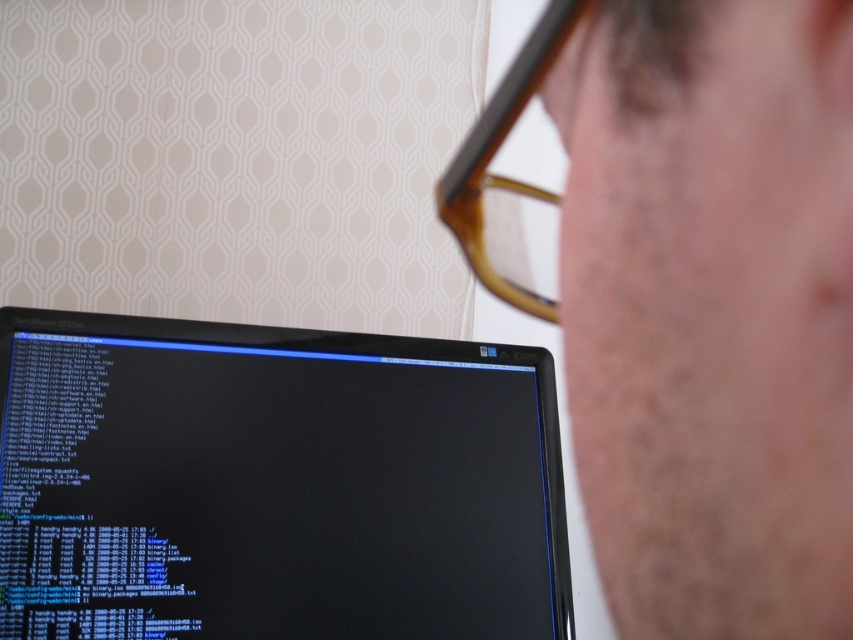
Which is in front, point (784, 192) or point (334, 369)?

Positioned in front is point (784, 192).

Where is `matte skin at center`? Image resolution: width=853 pixels, height=640 pixels. matte skin at center is located at coordinates (693, 298).

Locate an element on the screen. Image resolution: width=853 pixels, height=640 pixels. matte skin at center is located at coordinates point(693,298).

Is matte skin at center to the left of brown tortoiseshell glasses at upper center from the viewer's perspective?

Incorrect, matte skin at center is not on the left side of brown tortoiseshell glasses at upper center.

Can you confirm if matte skin at center is bigger than brown tortoiseshell glasses at upper center?

Indeed, matte skin at center has a larger size compared to brown tortoiseshell glasses at upper center.

Is point (764, 538) closer to viewer compared to point (526, 106)?

Yes, point (764, 538) is closer to viewer.

Find the location of `matte skin at center`. matte skin at center is located at coordinates (693, 298).

Between black glossy monitor at center and brown tortoiseshell glasses at upper center, which one is positioned lower?

Positioned lower is black glossy monitor at center.

In the scene shown: Who is higher up, black glossy monitor at center or brown tortoiseshell glasses at upper center?

brown tortoiseshell glasses at upper center

Which is in front, point (310, 488) or point (496, 90)?

Point (496, 90)

You are a GUI agent. You are given a task and a screenshot of the screen. Output one action in this format:
    pyautogui.click(x=<x>, y=<y>)
    Task: Click on the black glossy monitor at center
    Image resolution: width=853 pixels, height=640 pixels.
    Given the screenshot: What is the action you would take?
    pyautogui.click(x=274, y=483)